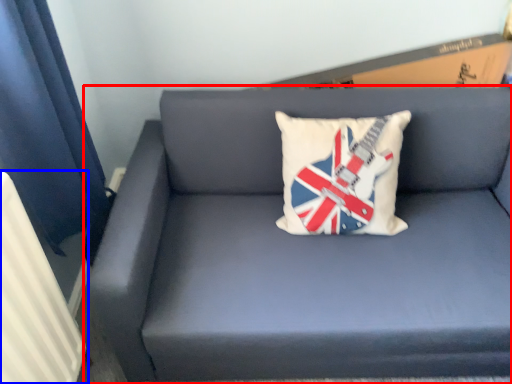
Question: Which object appears closest to the camera in this image, studio couch (highlighted by a red box) or radiator (highlighted by a blue box)?

Choices:
 (A) studio couch
 (B) radiator

Answer: (B)